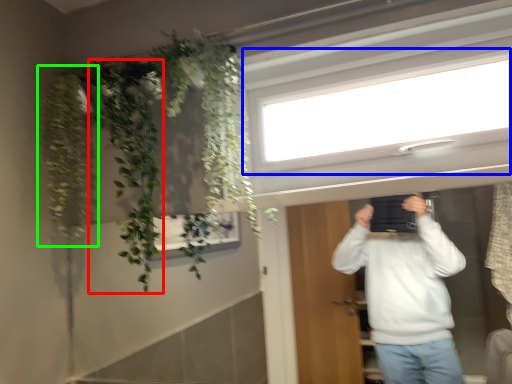
Question: Which is farther away from plant (highlighted by a red box)? window (highlighted by a blue box) or plant (highlighted by a green box)?

Choices:
 (A) window
 (B) plant

Answer: (A)